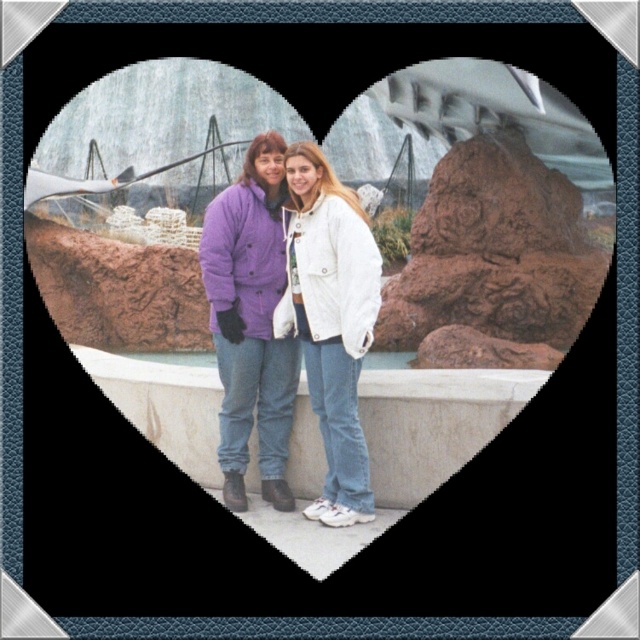
You are trying to decide whether to place a small potted plant between the purple cotton jacket at center and the white concrete ledge at center. Given their sizes, will the plant fit comfortably between them?

The purple cotton jacket at center is smaller than the white concrete ledge at center, so there should be enough space between them to place a small potted plant comfortably.

You are looking at the photo of two people near the fountain. The photo has a heart shape frame. There are two points marked in the image. One is at coordinate point (x=262, y=449) and the other is at coordinate point (x=115, y=355). Which point is closer to you, the viewer?

Point (x=262, y=449) is in front of point (x=115, y=355), so it is closer to the viewer.

Looking at this image, you are planning to place a small statue on the white concrete ledge at center. Considering the position of the purple cotton jacket at center, will the statue be visible to someone standing in front of the ledge?

The purple cotton jacket at center is above the white concrete ledge at center, so the statue placed on the ledge may be partially or fully blocked from view by the jacket.